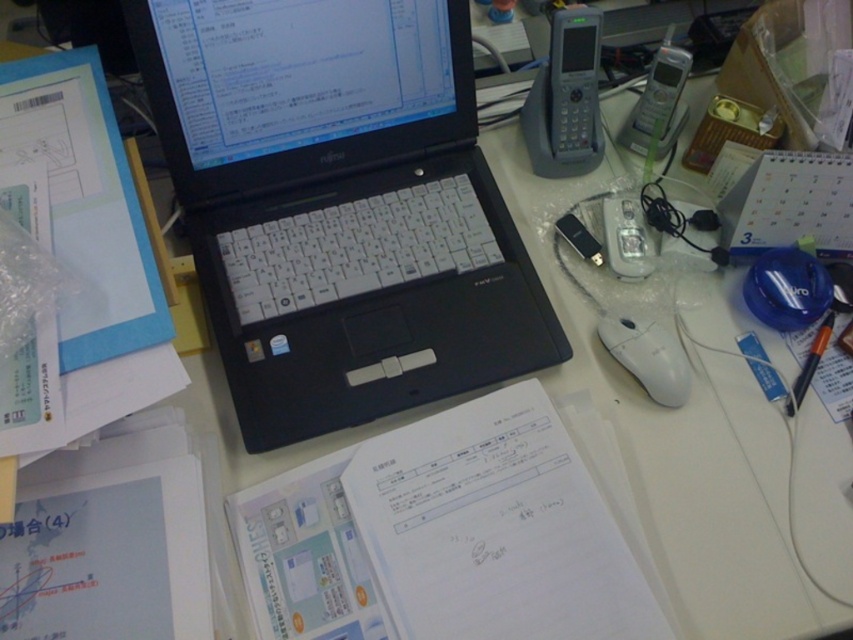
You are organizing the desk and need to place a new item exactly at the coordinates where the black matte laptop at center is currently located. What object is currently occupying that space?

The black matte laptop at center is currently occupying the space at coordinates point [339,205].

You are a delivery robot that needs to navigate to the location of point [654,342]. You are currently at point [206,163]. Given the workspace described, will you have to move forward or backward to reach your destination?

Since point [206,163] is closer to the viewer than point [654,342], you will need to move forward to reach the destination.